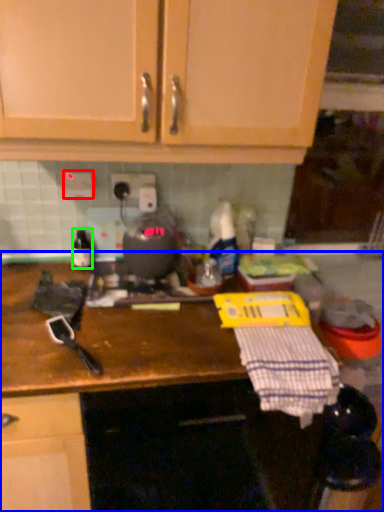
Question: Estimate the real-world distances between objects in this image. Which object is farther from electric outlet (highlighted by a red box), countertop (highlighted by a blue box) or bottle (highlighted by a green box)?

Choices:
 (A) countertop
 (B) bottle

Answer: (A)